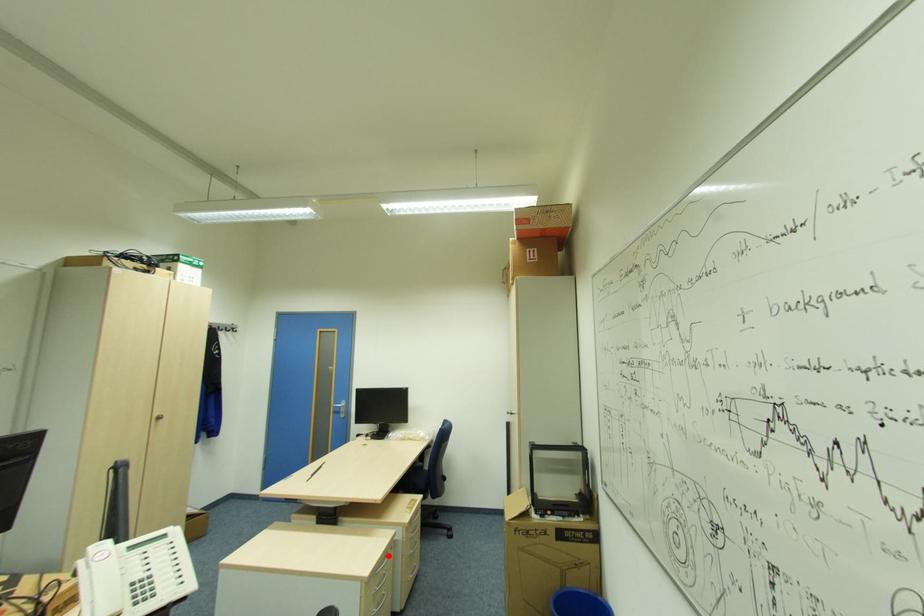
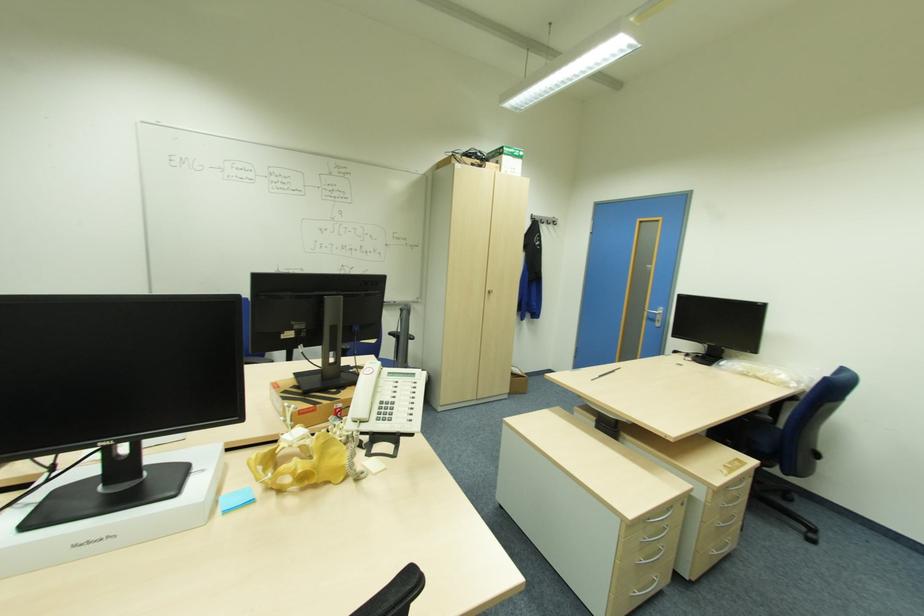
Locate, in the second image, the point that corresponds to the highlighted location in the first image.

(672, 511)